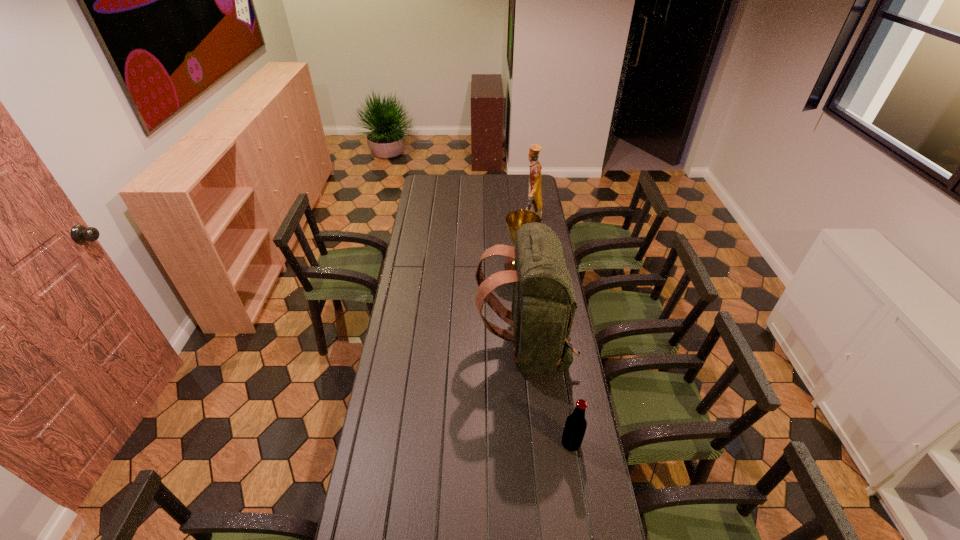
This screenshot has width=960, height=540. In order to click on vacant space located on the back of the third farthest object in this screenshot , I will do `click(388, 348)`.

Find the location of a particular element. vacant space situated 0.130m on the front-facing side of the third shortest object is located at coordinates (498, 218).

At what (x,y) coordinates should I click in order to perform the action: click on vacant space located on the front-facing side of the third shortest object. Please return your answer as a coordinate pair (x, y). This screenshot has width=960, height=540. Looking at the image, I should click on (474, 218).

Locate an element on the screen. The width and height of the screenshot is (960, 540). free space located on the front-facing side of the third shortest object is located at coordinates (511, 218).

Identify the location of vacant space located on the plaque of the third tallest object. This screenshot has height=540, width=960. (429, 273).

What are the coordinates of `blank area located 0.250m on the plaque of the third tallest object` in the screenshot? It's located at [452, 273].

Locate an element on the screen. free region located 0.320m on the plaque of the third tallest object is located at coordinates (x=438, y=273).

The image size is (960, 540). Find the location of `blank space located 0.150m on the front of the shortest object`. blank space located 0.150m on the front of the shortest object is located at coordinates (580, 500).

You are a GUI agent. You are given a task and a screenshot of the screen. Output one action in this format:
    pyautogui.click(x=<x>, y=<y>)
    Task: Click on the backpack that is at the right edge
    The height and width of the screenshot is (540, 960).
    Given the screenshot: What is the action you would take?
    pyautogui.click(x=543, y=307)

I want to click on nutcracker at the right edge, so click(535, 203).